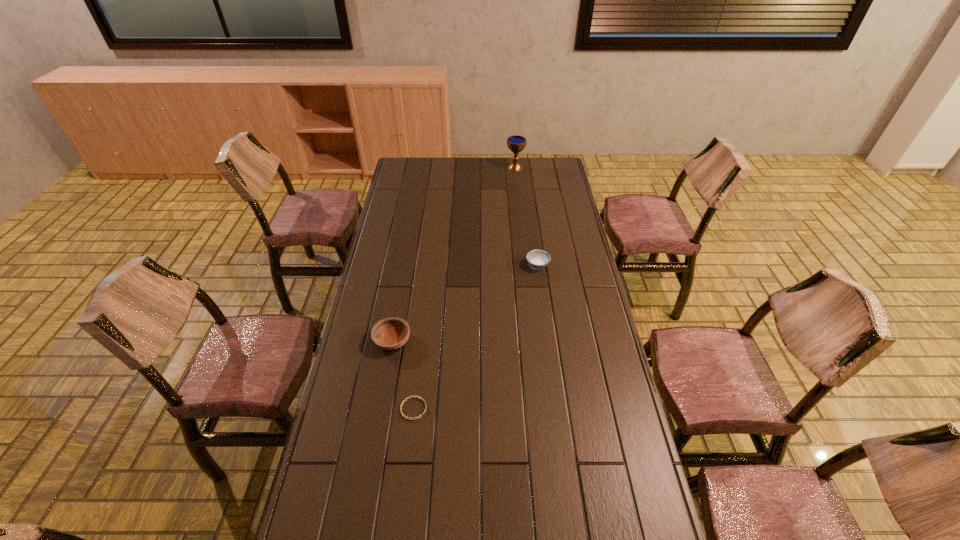
Find the location of a particular element. free space that satisfies the following two spatial constraints: 1. on the back side of the chalice; 2. on the right side of the third shortest object is located at coordinates (423, 167).

The height and width of the screenshot is (540, 960). In order to click on free region that satisfies the following two spatial constraints: 1. on the front side of the third tallest object; 2. on the surface of the shortest object showing star-shaped elements in this screenshot , I will do `click(558, 409)`.

This screenshot has width=960, height=540. Identify the location of blank space that satisfies the following two spatial constraints: 1. on the back side of the second tallest object; 2. on the right side of the tallest object. (423, 167).